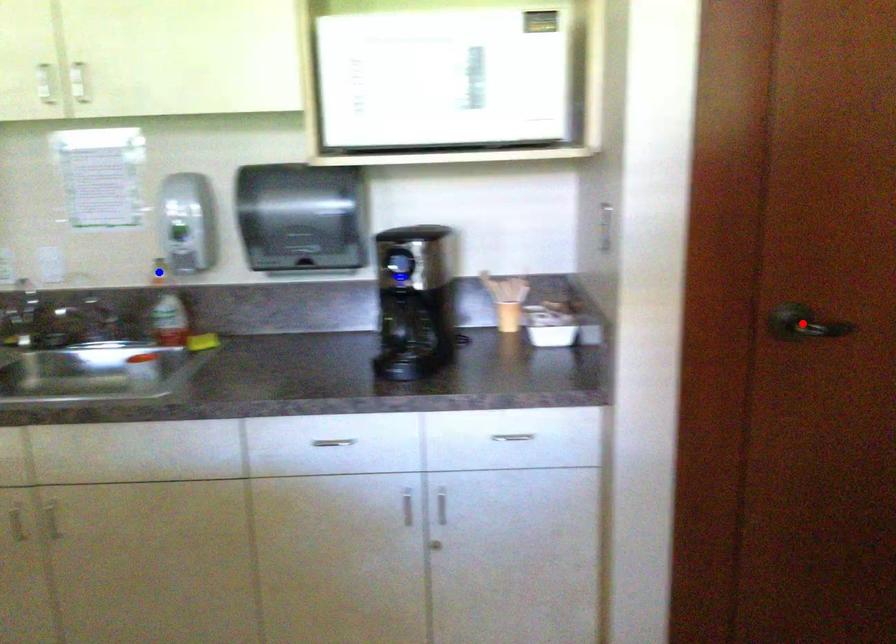
Question: Two points are marked on the image. Which point is closer to the camera?

Choices:
 (A) Blue point is closer.
 (B) Red point is closer.

Answer: (B)